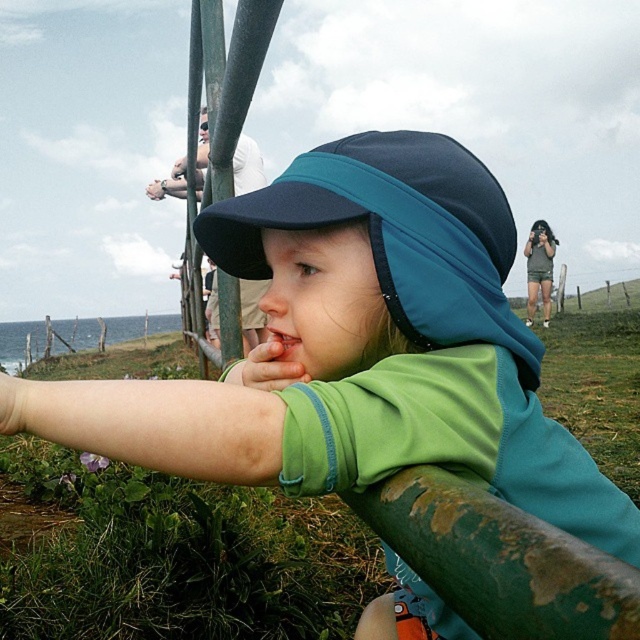
Which is behind, point (532, 289) or point (268, 346)?

The point (532, 289) is more distant.

How much distance is there between matte blue hat at upper center and pink glossy lips at center?

13.71 meters

This screenshot has height=640, width=640. Identify the location of matte blue hat at upper center. (540, 268).

Is navy blue fabric sun visor at center to the left of pink glossy lips at center from the viewer's perspective?

In fact, navy blue fabric sun visor at center is to the right of pink glossy lips at center.

Is point (488, 326) in front of point (284, 353)?

Yes, it is.

At what (x,y) coordinates should I click in order to perform the action: click on navy blue fabric sun visor at center. Please return your answer as a coordinate pair (x, y). The width and height of the screenshot is (640, 640). Looking at the image, I should click on (396, 234).

Does navy blue fabric sun visor at center lie in front of matte blue hat at upper center?

Yes, navy blue fabric sun visor at center is in front of matte blue hat at upper center.

Is navy blue fabric sun visor at center taller than matte blue hat at upper center?

Incorrect, navy blue fabric sun visor at center's height is not larger of matte blue hat at upper center's.

Who is more forward, (476, 257) or (545, 282)?

Point (476, 257) is more forward.

You are a GUI agent. You are given a task and a screenshot of the screen. Output one action in this format:
    pyautogui.click(x=<x>, y=<y>)
    Task: Click on the navy blue fabric sun visor at center
    The width and height of the screenshot is (640, 640).
    Given the screenshot: What is the action you would take?
    pyautogui.click(x=396, y=234)